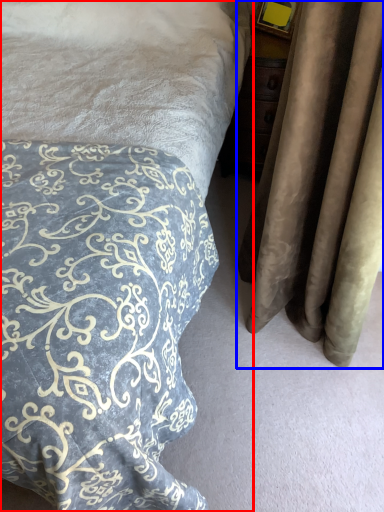
Question: Which point is further to the camera, bed (highlighted by a red box) or curtain (highlighted by a blue box)?

Choices:
 (A) bed
 (B) curtain

Answer: (B)